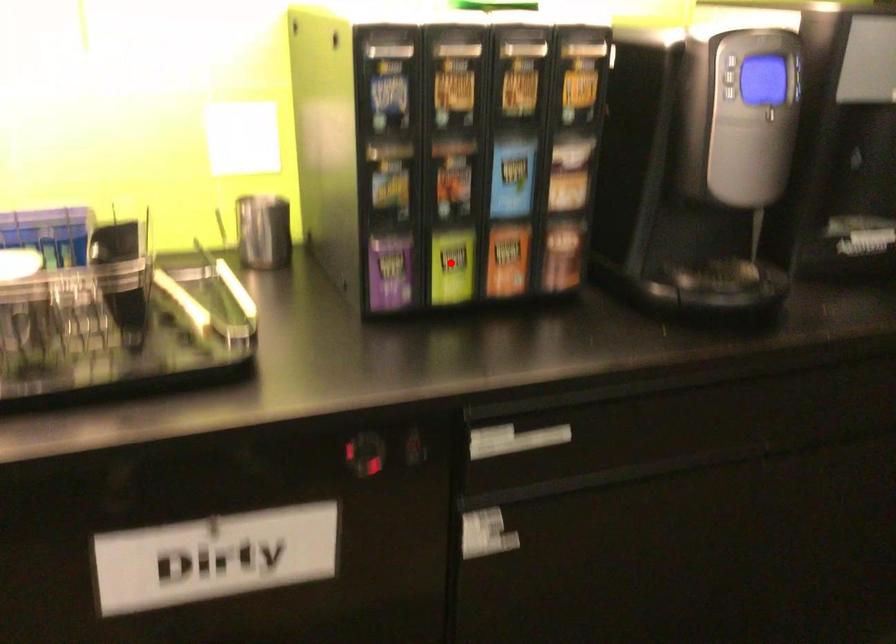
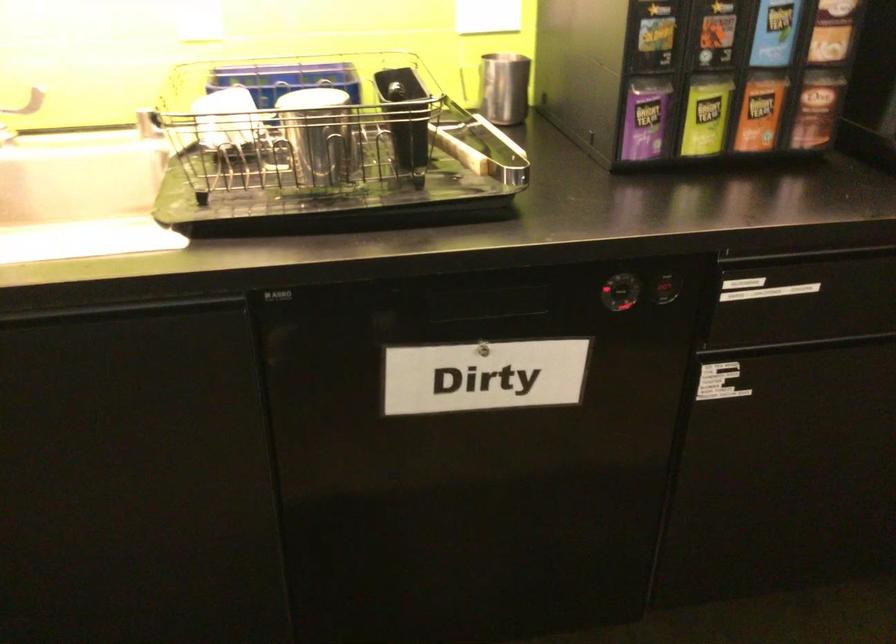
Where in the second image is the point corresponding to the highlighted location from the first image?

(705, 116)